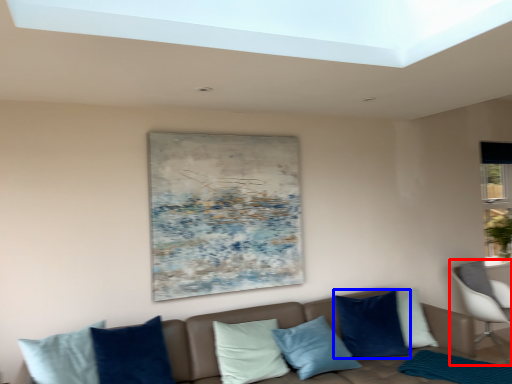
Question: Which object appears closest to the camera in this image, chair (highlighted by a red box) or pillow (highlighted by a blue box)?

Choices:
 (A) chair
 (B) pillow

Answer: (B)